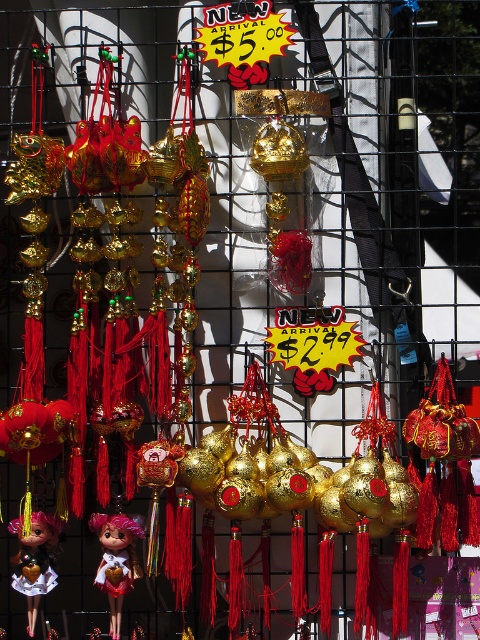
You are a customer in a store and want to buy a taller matte pink doll. Based on the image, which one should you choose between the matte pink doll at center and the matte pink doll at lower left?

The matte pink doll at center is taller than the matte pink doll at lower left, so you should choose the matte pink doll at center.